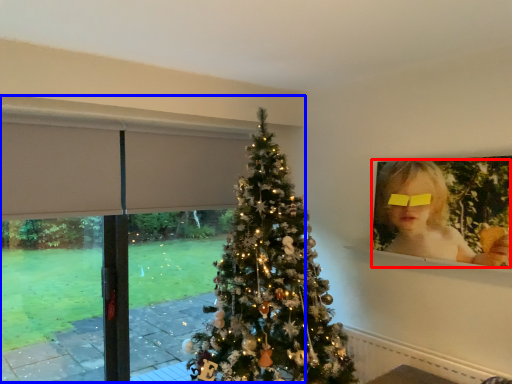
Question: Among these objects, which one is nearest to the camera, person (highlighted by a red box) or window frame (highlighted by a blue box)?

Choices:
 (A) person
 (B) window frame

Answer: (A)